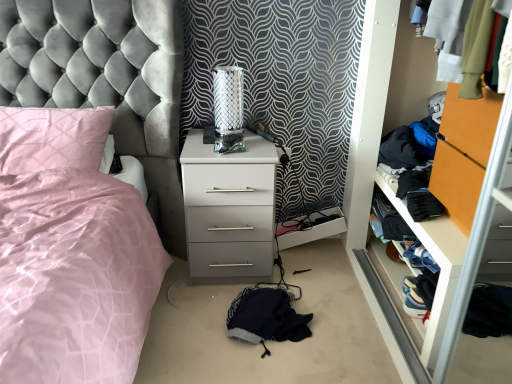
What are the coordinates of `free location to the right of fuzzy dark blue blanket at lower center, the third clothing from the right` in the screenshot? It's located at (347, 323).